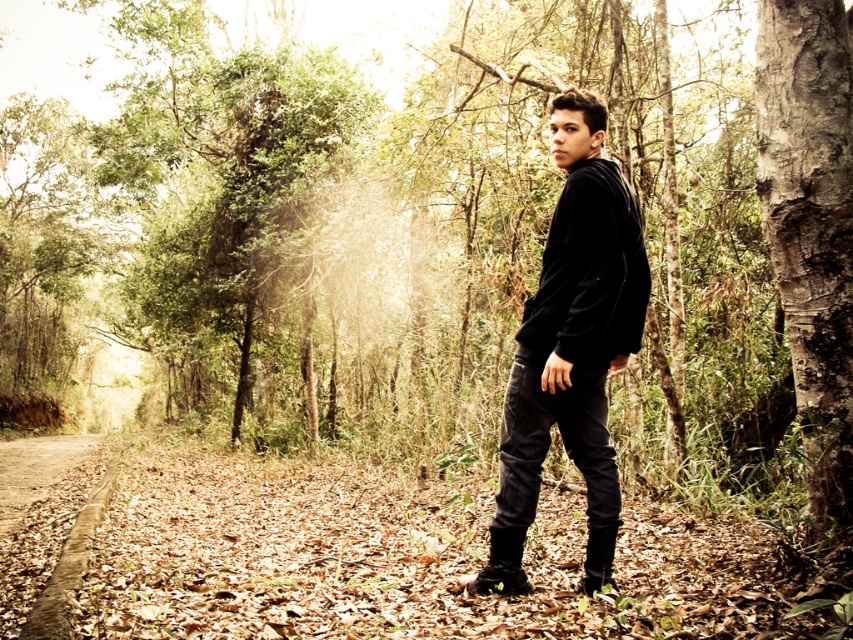
Does point (538, 406) come farther from viewer compared to point (590, 556)?

No, it is not.

Who is higher up, black velvet hoodie at center or black suede boot at lower center?

black velvet hoodie at center is above.

Where is `black velvet hoodie at center`? black velvet hoodie at center is located at coordinates (570, 339).

You are a GUI agent. You are given a task and a screenshot of the screen. Output one action in this format:
    pyautogui.click(x=<x>, y=<y>)
    Task: Click on the black velvet hoodie at center
    The image size is (853, 640).
    Given the screenshot: What is the action you would take?
    pyautogui.click(x=570, y=339)

Does leather boots at lower center have a lesser height compared to black suede boot at lower center?

Yes, leather boots at lower center is shorter than black suede boot at lower center.

Between point (485, 573) and point (604, 560), which one is positioned behind?

The point (485, 573) is more distant.

Find the location of a particular element. Image resolution: width=853 pixels, height=640 pixels. leather boots at lower center is located at coordinates (502, 564).

Looking at this image, can you confirm if brown dirt path at lower left is thinner than leather boots at lower center?

Incorrect, brown dirt path at lower left's width is not less than leather boots at lower center's.

Can you confirm if brown dirt path at lower left is positioned below leather boots at lower center?

Yes.

Is point (73, 502) in front of point (498, 541)?

No, (73, 502) is behind (498, 541).

Identify the location of brown dirt path at lower left. (47, 541).